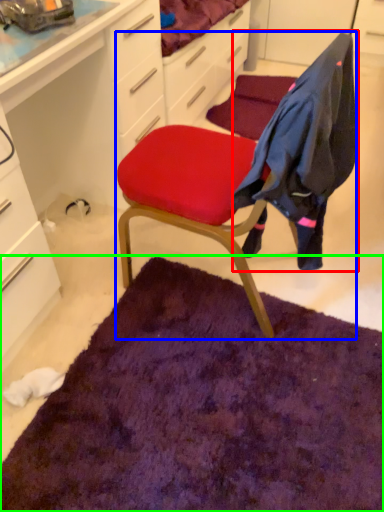
Question: Which is farther away from clothing (highlighted by a red box)? chair (highlighted by a blue box) or mat (highlighted by a green box)?

Choices:
 (A) chair
 (B) mat

Answer: (B)